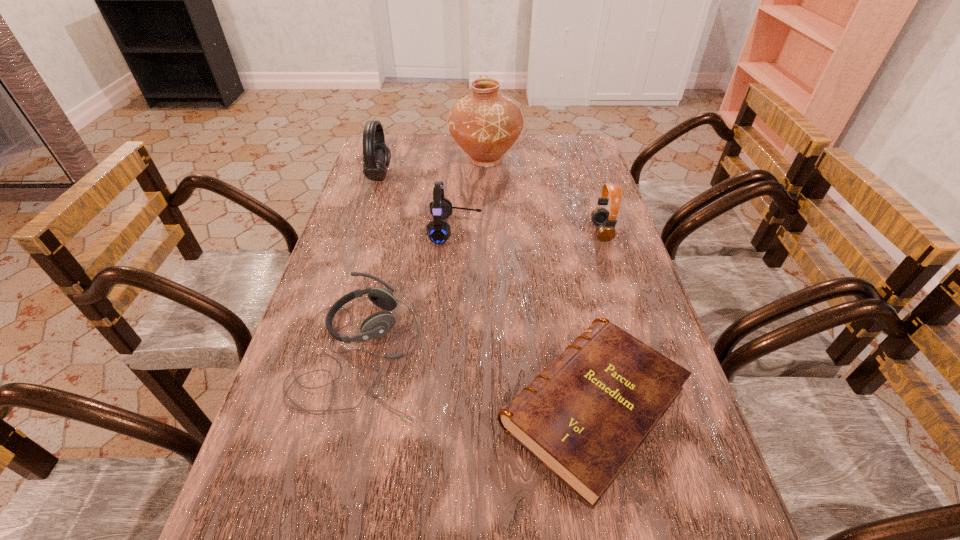
The width and height of the screenshot is (960, 540). What are the coordinates of `free space located on the ear cups of the rightmost headset` in the screenshot? It's located at (516, 232).

The image size is (960, 540). I want to click on vacant space located on the ear cups of the rightmost headset, so click(477, 232).

Find the location of a particular element. Image resolution: width=960 pixels, height=540 pixels. vacant space located on the outer surface of the shortest headset is located at coordinates (538, 351).

The width and height of the screenshot is (960, 540). Find the location of `free space located on the back of the hardback book`. free space located on the back of the hardback book is located at coordinates (564, 264).

I want to click on pottery at the far edge, so click(485, 124).

At what (x,y) coordinates should I click in order to perform the action: click on headset present at the far edge. Please return your answer as a coordinate pair (x, y). This screenshot has width=960, height=540. Looking at the image, I should click on (377, 155).

Where is `headset that is positioned at the right edge`? The image size is (960, 540). headset that is positioned at the right edge is located at coordinates (606, 221).

The height and width of the screenshot is (540, 960). I want to click on hardback book located at the right edge, so click(x=584, y=417).

The image size is (960, 540). Find the location of `object at the far left corner`. object at the far left corner is located at coordinates (377, 155).

I want to click on free space at the far edge of the desktop, so click(x=518, y=143).